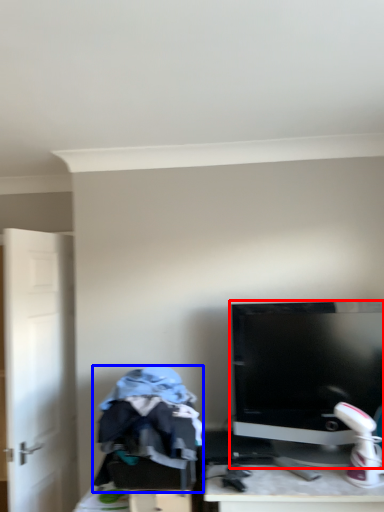
Question: Among these objects, which one is farthest to the camera, computer monitor (highlighted by a red box) or clothing (highlighted by a blue box)?

Choices:
 (A) computer monitor
 (B) clothing

Answer: (A)